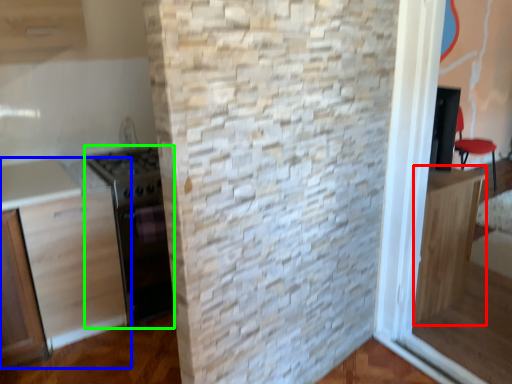
Question: Which object is the closest to the cabinetry (highlighted by a red box)? Choose among these: cabinetry (highlighted by a blue box) or appliance (highlighted by a green box).

Choices:
 (A) cabinetry
 (B) appliance

Answer: (B)